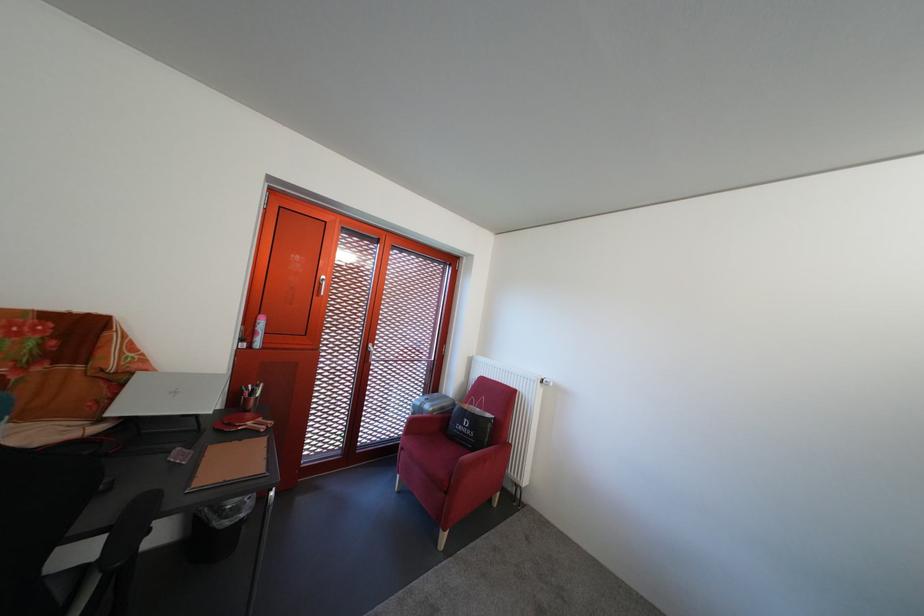
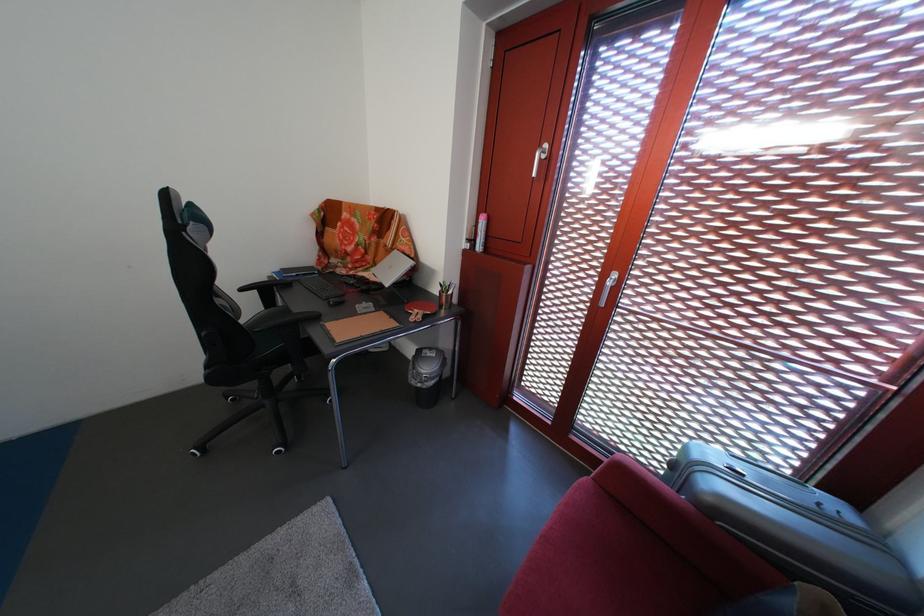
Find the pixel in the second image that matches the point at 252,346 in the first image.

(479, 246)